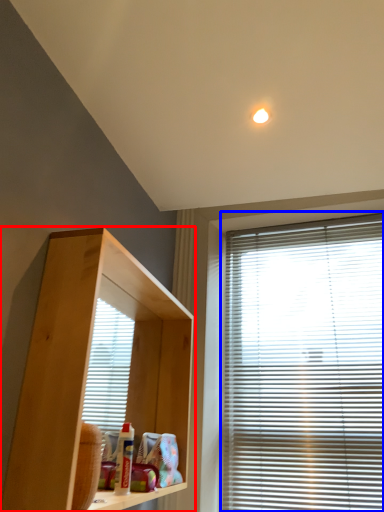
Question: Which object is further to the camera taking this photo, shelf (highlighted by a red box) or window blind (highlighted by a blue box)?

Choices:
 (A) shelf
 (B) window blind

Answer: (B)